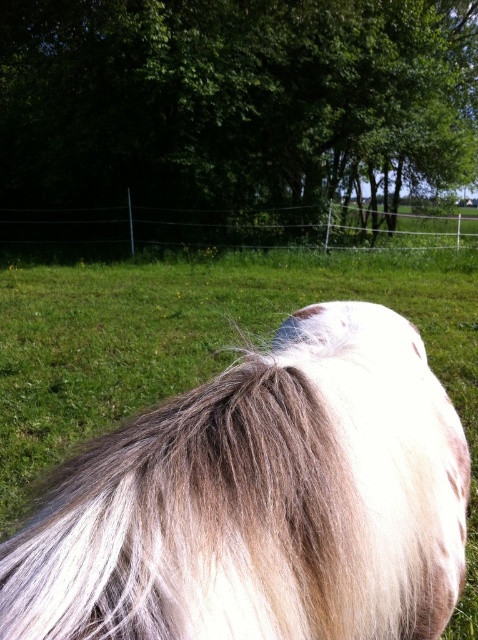
Based on the photo, you are taking a photo of the horse and notice two points in the image labeled as point [398,104] and point [315,211]. Which point is closer to the camera?

Point [398,104] is further to the camera than point [315,211], so the point closer to the camera is point [315,211].

You are a photographer trying to capture the white silky mane at center and the black wire fence at upper center in the same frame. Based on their positions, which one appears closer to the camera?

The white silky mane at center appears closer to the camera because it has a lesser height compared to the black wire fence at upper center, indicating it is in front.